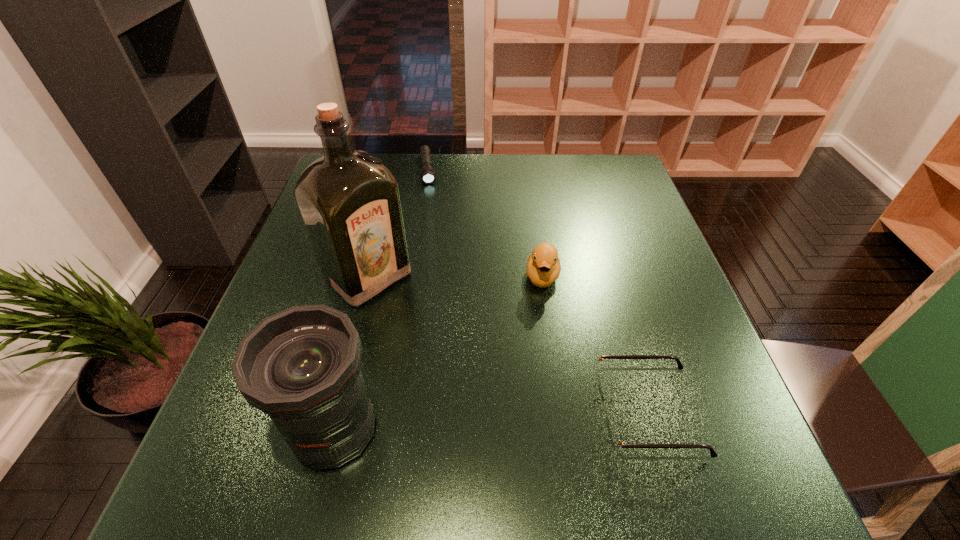
In order to click on vacant spot on the desktop that is between the fourth shortest object and the second shortest object and is positioned on the face of the fourth object from left to right in this screenshot , I will do `click(534, 419)`.

Where is `free spot on the desktop that is between the telephoto lens and the second shortest object and is positioned on the label of the liquor`? The height and width of the screenshot is (540, 960). free spot on the desktop that is between the telephoto lens and the second shortest object and is positioned on the label of the liquor is located at coordinates (535, 419).

I want to click on vacant space on the desktop that is between the second tallest object and the second shortest object and is positioned at the lens end of the flashlight, so click(x=460, y=423).